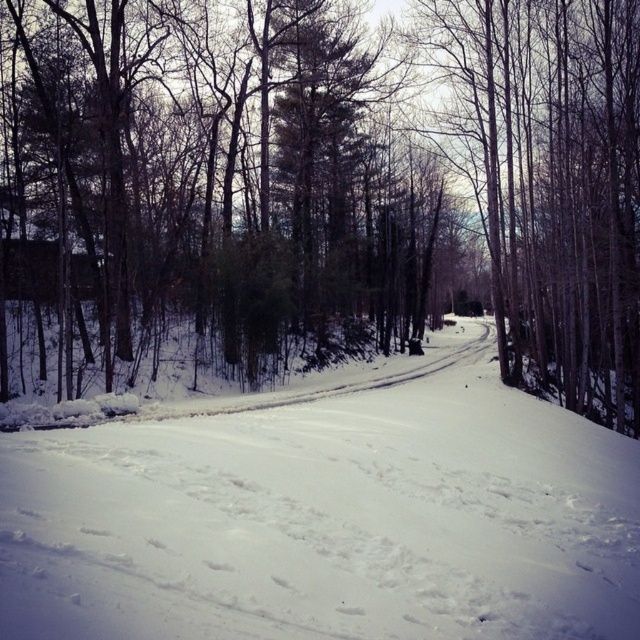
Does green textured pine tree at center have a greater width compared to white powdery snow at center?

Yes.

Does green textured pine tree at center appear on the left side of white powdery snow at center?

Incorrect, green textured pine tree at center is not on the left side of white powdery snow at center.

Which is behind, point (518, 339) or point (416, 512)?

The point (518, 339) is more distant.

Where is `green textured pine tree at center`? The width and height of the screenshot is (640, 640). green textured pine tree at center is located at coordinates (320, 186).